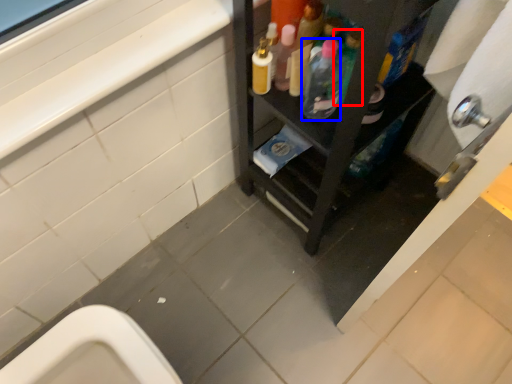
Question: Among these objects, which one is nearest to the camera, bottle (highlighted by a red box) or bottle (highlighted by a blue box)?

Choices:
 (A) bottle
 (B) bottle

Answer: (A)